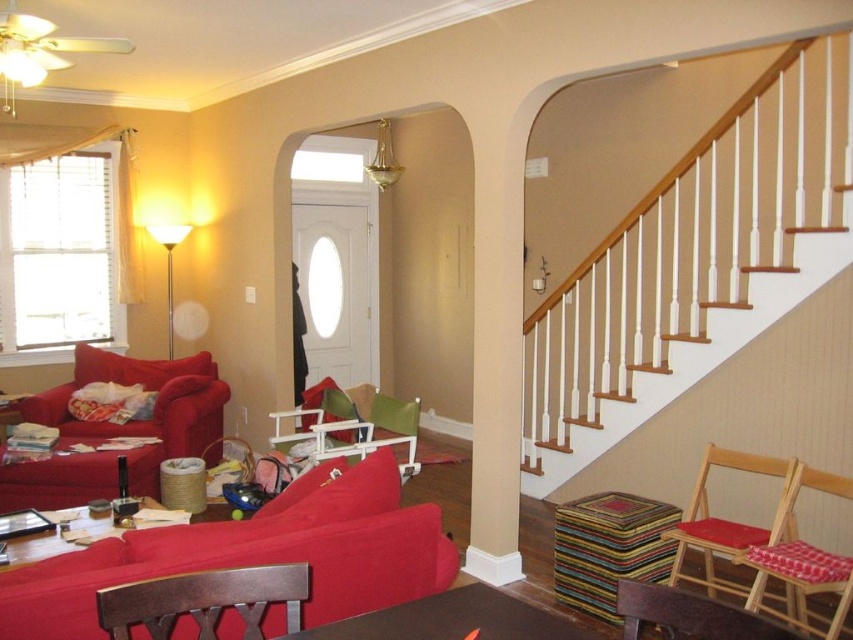
Who is taller, wooden folding chair with checkered cushion at right or wooden armchair at lower right?

Standing taller between the two is wooden folding chair with checkered cushion at right.

Does wooden folding chair with checkered cushion at right come in front of wooden armchair at lower right?

No, wooden folding chair with checkered cushion at right is behind wooden armchair at lower right.

Who is more forward, (766, 557) or (728, 634)?

Point (728, 634) is in front.

This screenshot has height=640, width=853. In order to click on wooden folding chair with checkered cushion at right in this screenshot , I will do `click(802, 557)`.

Who is positioned more to the left, wooden stair at upper right or smooth wooden table at lower left?

smooth wooden table at lower left is more to the left.

Is point (779, 296) positioned in front of point (10, 550)?

No, (779, 296) is behind (10, 550).

The width and height of the screenshot is (853, 640). Identify the location of wooden stair at upper right. (700, 353).

Can you confirm if multicolored woven stool at lower right is bigger than smooth wooden table at lower left?

Yes, multicolored woven stool at lower right is bigger than smooth wooden table at lower left.

Measure the distance from multicolored woven stool at lower right to smooth wooden table at lower left.

multicolored woven stool at lower right is 1.92 meters from smooth wooden table at lower left.

You are a GUI agent. You are given a task and a screenshot of the screen. Output one action in this format:
    pyautogui.click(x=<x>, y=<y>)
    Task: Click on the multicolored woven stool at lower right
    The height and width of the screenshot is (640, 853).
    Given the screenshot: What is the action you would take?
    pyautogui.click(x=608, y=548)